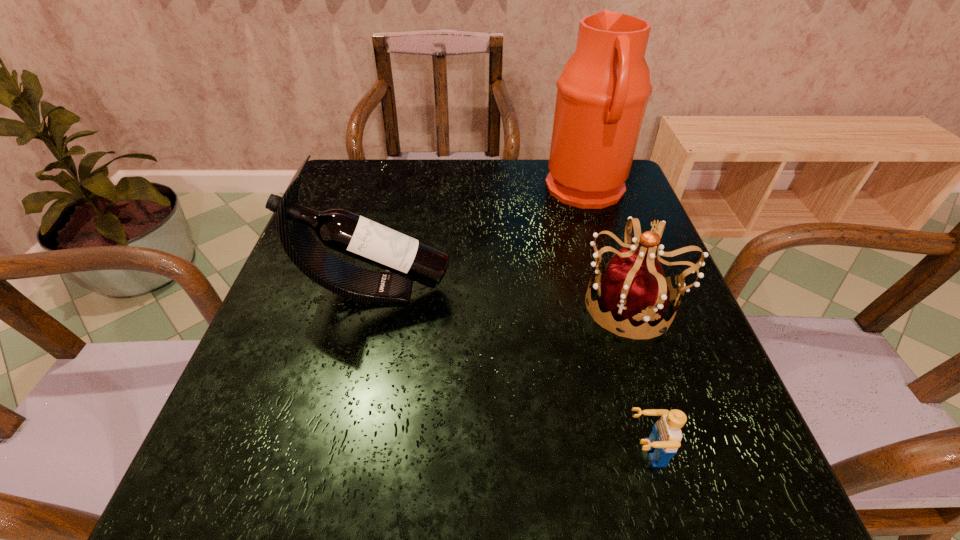
The height and width of the screenshot is (540, 960). Find the location of `vacant space located 0.290m on the stand of the leftmost object`. vacant space located 0.290m on the stand of the leftmost object is located at coordinates (591, 289).

I want to click on vacant space located on the front-facing side of the second shortest object, so click(x=456, y=305).

Locate an element on the screen. The height and width of the screenshot is (540, 960). blank space located 0.220m on the front-facing side of the second shortest object is located at coordinates (470, 305).

Locate an element on the screen. vacant space positioned 0.320m on the front-facing side of the second shortest object is located at coordinates click(420, 305).

At what (x,y) coordinates should I click in order to perform the action: click on free spot located 0.250m on the face of the Lego. Please return your answer as a coordinate pair (x, y). The height and width of the screenshot is (540, 960). Looking at the image, I should click on (459, 453).

Find the location of a particular element. The image size is (960, 540). vacant area located 0.260m on the face of the Lego is located at coordinates (452, 453).

Where is `free space located 0.180m on the face of the Lego`? The image size is (960, 540). free space located 0.180m on the face of the Lego is located at coordinates (505, 453).

The width and height of the screenshot is (960, 540). Identify the location of object situated at the far edge. tap(603, 91).

Locate an element on the screen. object that is positioned at the near edge is located at coordinates (664, 440).

Identify the location of object at the left edge. (408, 259).